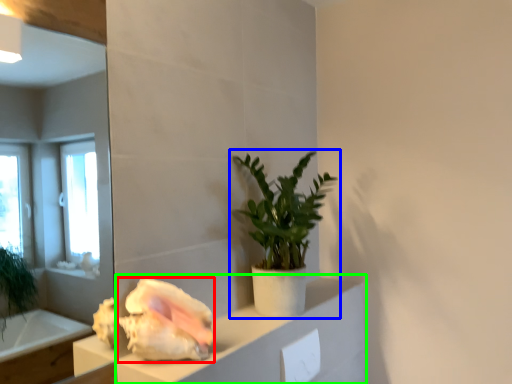
Question: Estimate the real-world distances between objects in this image. Which object is farther from flower (highlighted by a red box), houseplant (highlighted by a blue box) or cabinetry (highlighted by a green box)?

Choices:
 (A) houseplant
 (B) cabinetry

Answer: (A)